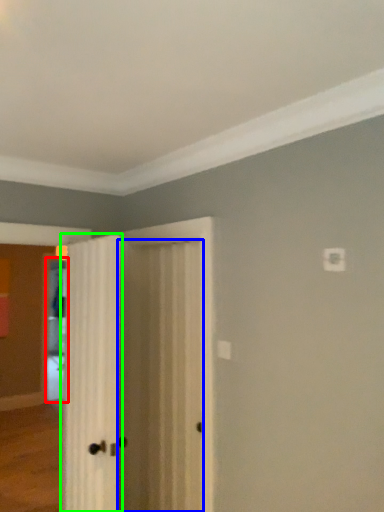
Question: Estimate the real-world distances between objects in this image. Which object is closer to screen door (highlighted by a red box), door (highlighted by a blue box) or door (highlighted by a green box)?

Choices:
 (A) door
 (B) door

Answer: (A)